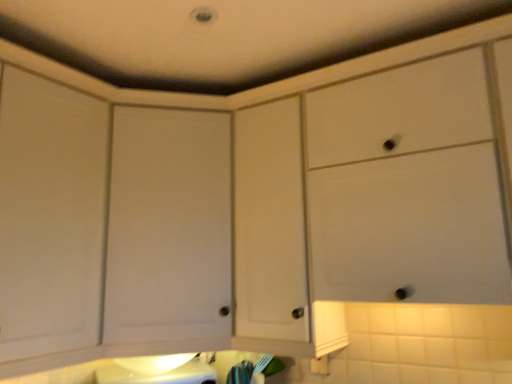
Question: Is white matte cabinet door at center, the 2th cabinetry viewed from the right, thinner than white matte cabinet at upper center, which is counted as the first cabinetry, starting from the right?

Choices:
 (A) no
 (B) yes

Answer: (A)

Question: Is white matte cabinet door at center, which is the 1th cabinetry from left to right, smaller than white matte cabinet at upper center, the second cabinetry from the left?

Choices:
 (A) no
 (B) yes

Answer: (B)

Question: Is white matte cabinet door at center, which is the 1th cabinetry from left to right, facing towards white matte cabinet at upper center, the second cabinetry from the left?

Choices:
 (A) no
 (B) yes

Answer: (A)

Question: From the image's perspective, does white matte cabinet door at center, the 2th cabinetry viewed from the right, appear lower than white matte cabinet at upper center, which is counted as the first cabinetry, starting from the right?

Choices:
 (A) yes
 (B) no

Answer: (A)

Question: Can you confirm if white matte cabinet door at center, the 2th cabinetry viewed from the right, is taller than white matte cabinet at upper center, which is counted as the first cabinetry, starting from the right?

Choices:
 (A) no
 (B) yes

Answer: (B)

Question: Is white matte cabinet at upper center, which is counted as the first cabinetry, starting from the right, inside white matte cabinet door at center, the 2th cabinetry viewed from the right?

Choices:
 (A) yes
 (B) no

Answer: (B)

Question: From the image's perspective, would you say white matte cabinet at upper center, which is counted as the first cabinetry, starting from the right, is positioned over white matte cabinet door at center, which is the 1th cabinetry from left to right?

Choices:
 (A) yes
 (B) no

Answer: (A)

Question: From a real-world perspective, is white matte cabinet at upper center, which is counted as the first cabinetry, starting from the right, on top of white matte cabinet door at center, which is the 1th cabinetry from left to right?

Choices:
 (A) no
 (B) yes

Answer: (A)

Question: Is white matte cabinet door at center, the 2th cabinetry viewed from the right, inside white matte cabinet at upper center, the second cabinetry from the left?

Choices:
 (A) yes
 (B) no

Answer: (B)

Question: Does white matte cabinet at upper center, which is counted as the first cabinetry, starting from the right, have a lesser height compared to white matte cabinet door at center, which is the 1th cabinetry from left to right?

Choices:
 (A) yes
 (B) no

Answer: (A)

Question: Can you confirm if white matte cabinet at upper center, the second cabinetry from the left, is thinner than white matte cabinet door at center, which is the 1th cabinetry from left to right?

Choices:
 (A) yes
 (B) no

Answer: (A)

Question: Is white matte cabinet at upper center, which is counted as the first cabinetry, starting from the right, not inside white matte cabinet door at center, the 2th cabinetry viewed from the right?

Choices:
 (A) no
 (B) yes

Answer: (B)

Question: From a real-world perspective, is white matte cabinet at upper center, which is counted as the first cabinetry, starting from the right, above or below white matte cabinet door at center, the 2th cabinetry viewed from the right?

Choices:
 (A) above
 (B) below

Answer: (B)